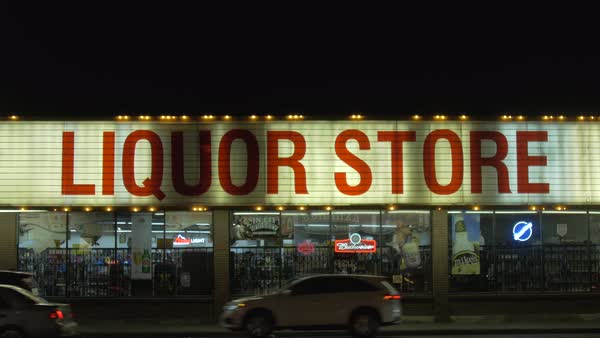
I want to click on burnt out lights, so click(x=191, y=154), click(x=259, y=129), click(x=166, y=133).